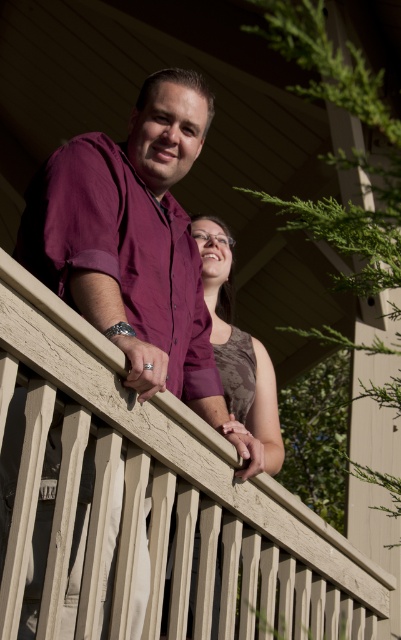
Question: Which point is closer to the camera?

Choices:
 (A) (76, 212)
 (B) (224, 332)

Answer: (A)

Question: Which point is closer to the camera?

Choices:
 (A) brown textured dress at center
 (B) matte purple shirt at upper left

Answer: (B)

Question: Which object appears closest to the camera in this image?

Choices:
 (A) brown textured dress at center
 (B) matte purple shirt at upper left
 (C) beige textured railing at upper center

Answer: (C)

Question: Is the position of matte purple shirt at upper left less distant than that of brown textured dress at center?

Choices:
 (A) yes
 (B) no

Answer: (A)

Question: Does matte purple shirt at upper left have a greater width compared to brown textured dress at center?

Choices:
 (A) yes
 (B) no

Answer: (A)

Question: Can you confirm if matte purple shirt at upper left is positioned below brown textured dress at center?

Choices:
 (A) no
 (B) yes

Answer: (A)